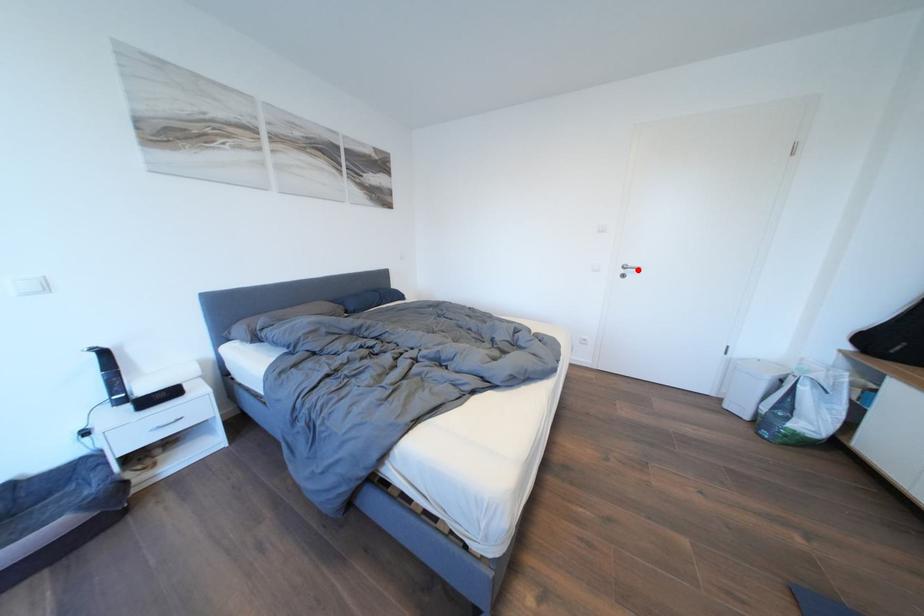
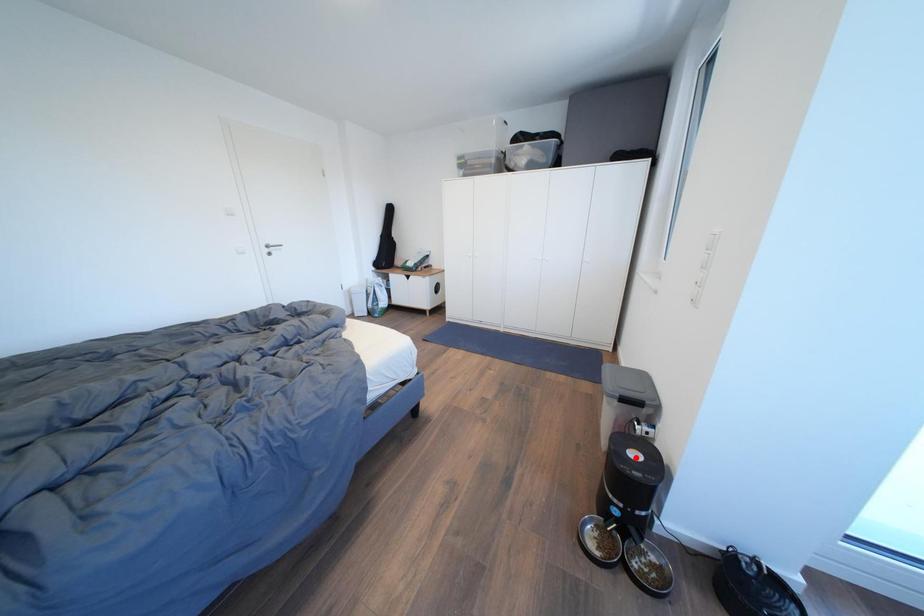
I am providing you with two images of the same scene from different viewpoints. A red point is marked on the first image and another point is marked on the second image. Do the highlighted points in image1 and image2 indicate the same real-world spot?

No